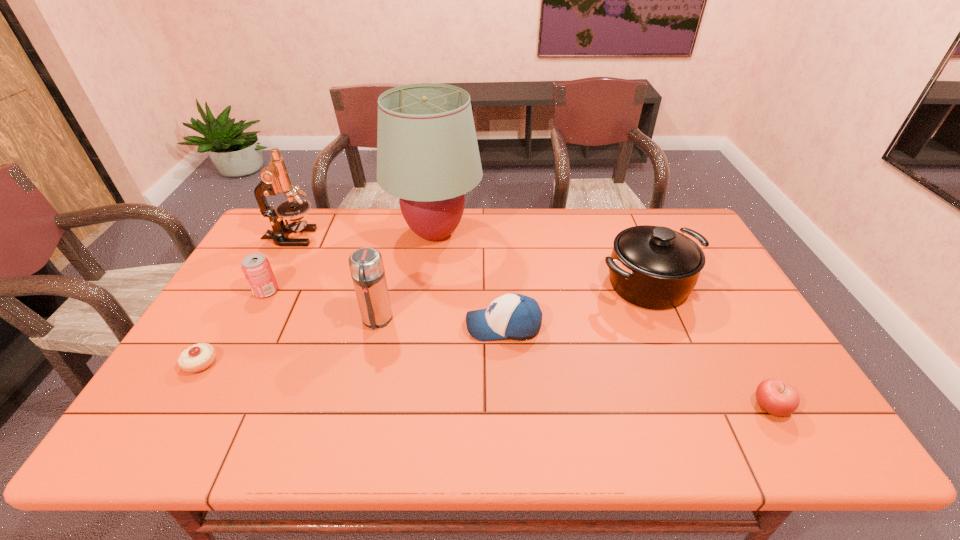
At what (x,y) coordinates should I click in order to perform the action: click on vacant area at the far edge. Please return your answer as a coordinate pair (x, y). The width and height of the screenshot is (960, 540). Looking at the image, I should click on (391, 225).

Locate an element on the screen. vacant space at the left edge of the desktop is located at coordinates (233, 360).

I want to click on vacant space at the right edge, so click(756, 347).

What are the coordinates of `vacant space at the near right corner` in the screenshot? It's located at (792, 445).

Image resolution: width=960 pixels, height=540 pixels. I want to click on blank region between the tallest object and the apple, so click(x=603, y=320).

Where is `vacant point located between the microscope and the thermos bottle`? The image size is (960, 540). vacant point located between the microscope and the thermos bottle is located at coordinates (334, 279).

What are the coordinates of `vacant space in between the thermos bottle and the shortest object` in the screenshot? It's located at [x=289, y=341].

This screenshot has width=960, height=540. In order to click on free area in between the seventh farthest object and the baseball cap in this screenshot , I will do `click(352, 345)`.

Locate an element on the screen. This screenshot has height=540, width=960. vacant space in between the lampshade and the seventh shortest object is located at coordinates (363, 235).

This screenshot has height=540, width=960. Identify the location of unoccupied area between the seventh farthest object and the thermos bottle. (289, 341).